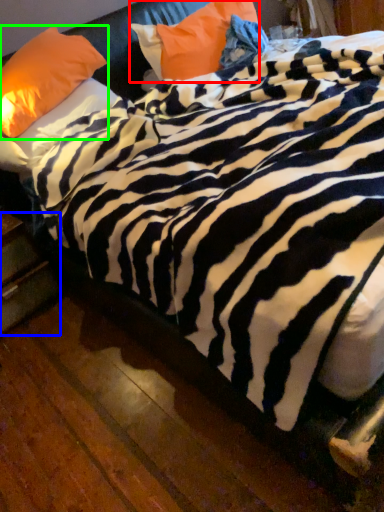
Question: Which is nearer to the pillow (highlighted by a red box)? drawer (highlighted by a blue box) or pillow (highlighted by a green box).

Choices:
 (A) drawer
 (B) pillow

Answer: (B)